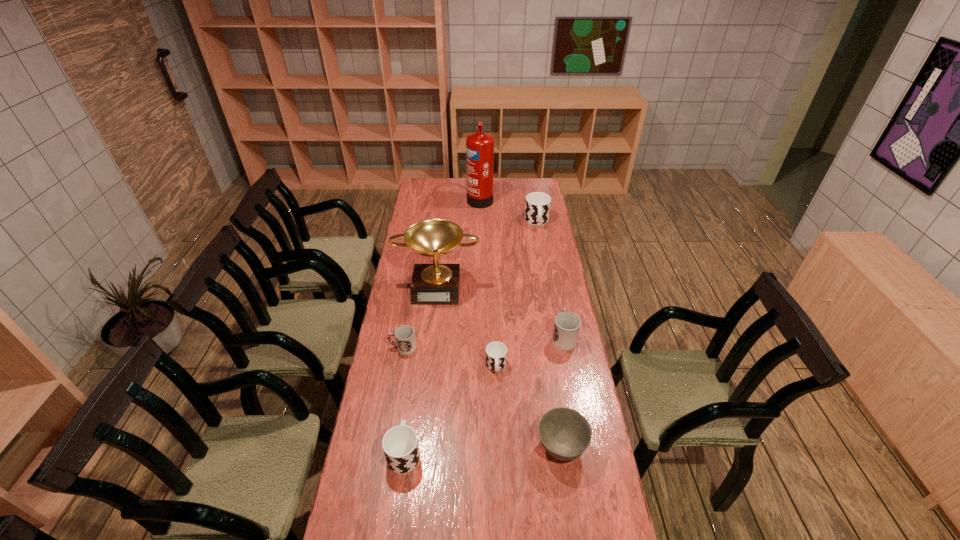
This screenshot has width=960, height=540. I want to click on vacant space at the left edge of the desktop, so click(x=413, y=319).

This screenshot has height=540, width=960. In the image, there is a desktop. Identify the location of free space at the right edge. (556, 383).

In the image, there is a desktop. Identify the location of vacant region at the far right corner. (540, 190).

Where is `vacant space that's between the right red cup and the left red cup`? vacant space that's between the right red cup and the left red cup is located at coordinates (483, 342).

Locate an element on the screen. free space between the leftmost black cup and the rightmost black cup is located at coordinates (470, 337).

At what (x,y) coordinates should I click in order to perform the action: click on empty space between the bigger red cup and the rightmost black cup. Please return your answer as a coordinate pair (x, y). Image resolution: width=960 pixels, height=540 pixels. Looking at the image, I should click on (550, 279).

The width and height of the screenshot is (960, 540). I want to click on empty space between the bowl and the left red cup, so click(x=482, y=397).

Identify the location of free space between the sixth farthest object and the seventh shortest object. pos(467,326).

This screenshot has width=960, height=540. Find the location of `free space between the fourth farthest cup and the right red cup`. free space between the fourth farthest cup and the right red cup is located at coordinates (530, 352).

Locate an element on the screen. This screenshot has height=540, width=960. object that is the fifth closest to the biggest black cup is located at coordinates (405, 338).